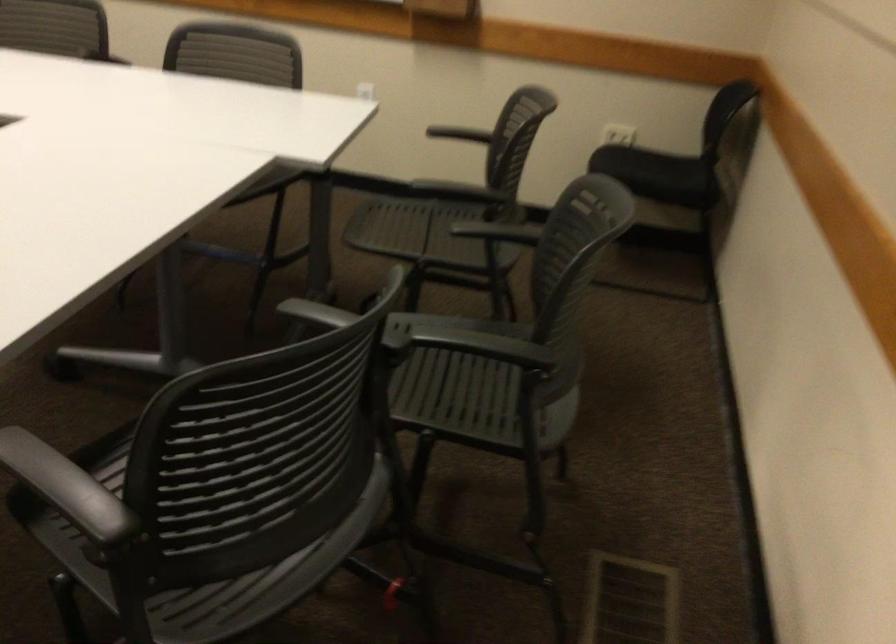
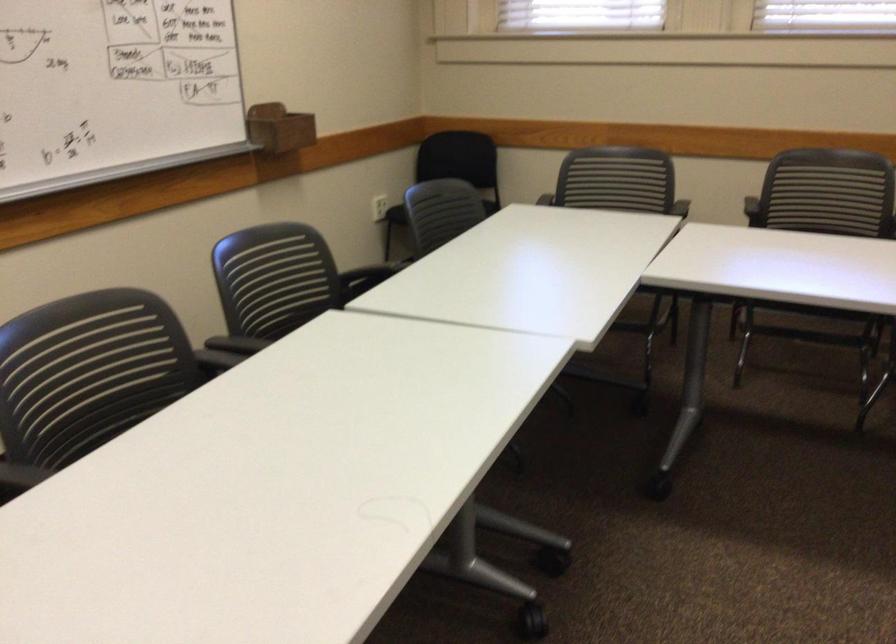
Question: I am providing you with two images of the same scene from different viewpoints. Which of the following objects are not visible in image2?

Choices:
 (A) chair sitting surface
 (B) wooden marker holder
 (C) black chair armrest
 (D) green patterned lanyard

Answer: (A)